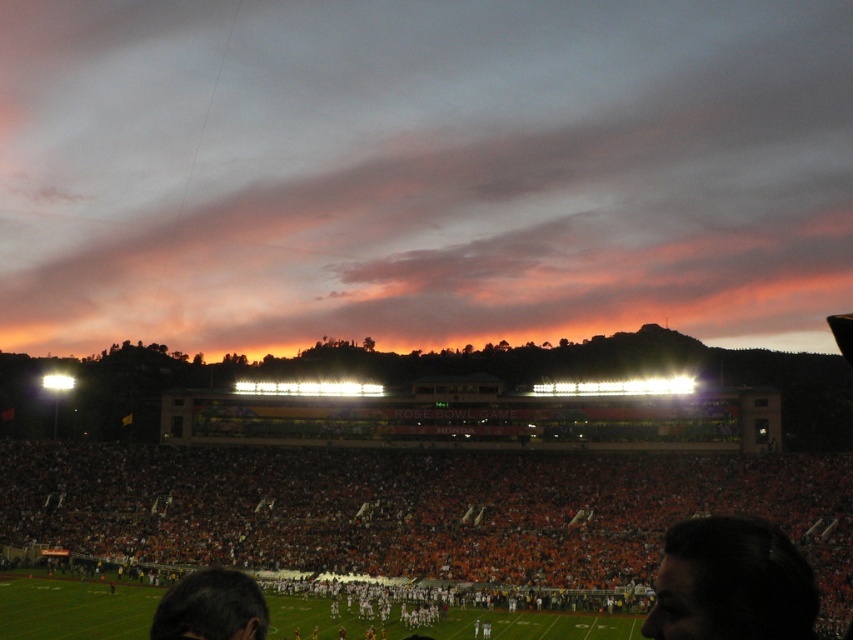
Consider the image. You are a photographer standing at the edge of the field during the football game. You want to take a photo of the dark hair at lower right without the orange fabric crowd at lower center blocking the view. Is this possible?

The orange fabric crowd at lower center is further to the viewer than dark hair at lower right, so the dark hair at lower right is closer to you. Therefore, you can take a photo of the dark hair at lower right without the orange fabric crowd at lower center blocking the view.

You are a photographer standing at the edge of the field during a football game. You want to take a photo of the dark hair at lower left without the orange fabric crowd at lower center blocking the view. Is this possible?

The orange fabric crowd at lower center is further to the viewer than dark hair at lower left, so the dark hair at lower left is closer to you. Therefore, you can take a photo of the dark hair at lower left without the orange fabric crowd at lower center blocking the view.

You are a photographer standing at the edge of the field during the Rose Bowl Game. You want to take a photo of the dark hair at lower right without the orange fabric crowd at lower center blocking the view. Is this possible?

The orange fabric crowd at lower center is much taller than the dark hair at lower right, so it will block the view of the dark hair at lower right. You might need to move to a higher position to capture the dark hair at lower right without obstruction.